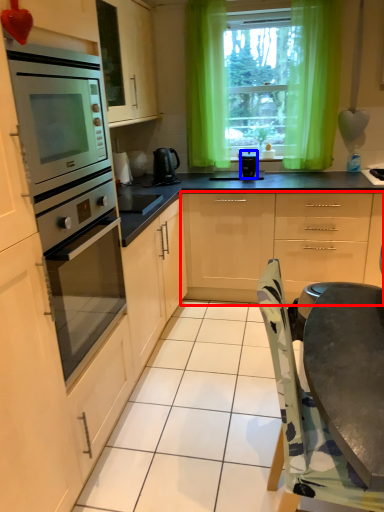
Question: Among these objects, which one is nearest to the camera, cabinetry (highlighted by a red box) or kitchen appliance (highlighted by a blue box)?

Choices:
 (A) cabinetry
 (B) kitchen appliance

Answer: (A)